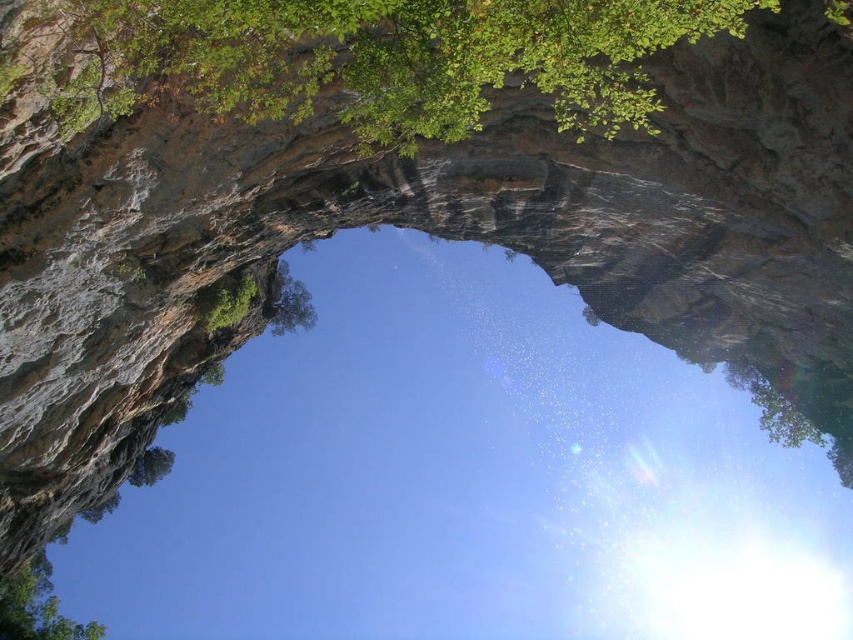
You are standing at the base of the rock formation and want to take a photo of the green leafy tree at upper center. Your camera has a maximum focus range of 50 feet. Will you be able to focus on the tree?

The green leafy tree at upper center and the viewer are 54.77 feet apart, which exceeds the camera maximum focus range of 50 feet. Therefore, the camera cannot focus on the tree.

You are a hiker standing at the base of the rock formation and want to take a photo of the transparent water at center and the green leafy tree at lower left. Which object should you focus on first if you want both to be in sharp focus?

You should focus on the green leafy tree at lower left first because it is closer to you than the transparent water at center, ensuring both will be in focus when using the hyperfocal distance technique.